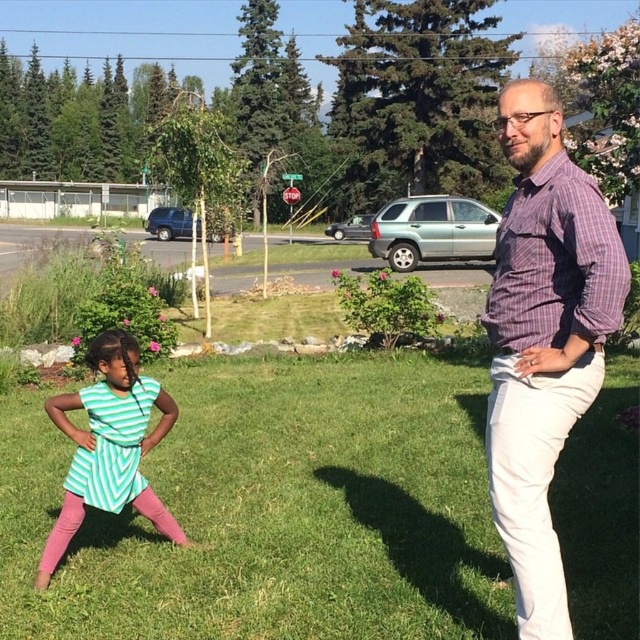
Question: Which object appears closest to the camera in this image?

Choices:
 (A) green grass at center
 (B) green striped dress at lower left

Answer: (B)

Question: Can you confirm if green grass at center is smaller than purple checkered shirt at right?

Choices:
 (A) yes
 (B) no

Answer: (A)

Question: Which object appears closest to the camera in this image?

Choices:
 (A) green striped dress at lower left
 (B) green grass at center
 (C) purple checkered shirt at right

Answer: (C)

Question: Can you confirm if green grass at center is smaller than purple checkered shirt at right?

Choices:
 (A) yes
 (B) no

Answer: (A)

Question: Observing the image, what is the correct spatial positioning of green grass at center in reference to green striped dress at lower left?

Choices:
 (A) above
 (B) below

Answer: (A)

Question: Based on their relative distances, which object is nearer to the purple checkered shirt at right?

Choices:
 (A) green striped dress at lower left
 (B) green grass at center

Answer: (A)